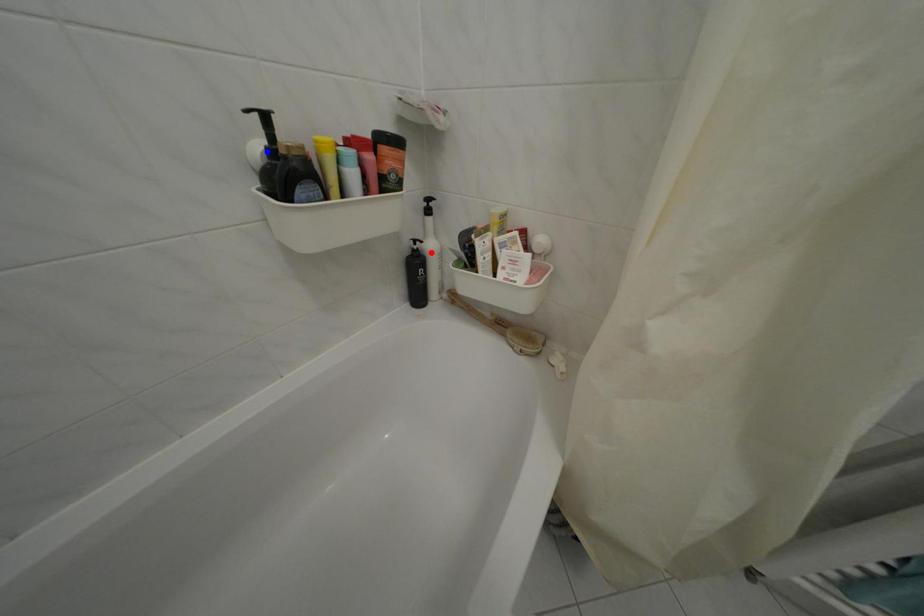
Question: Two points are marked on the image. Which point is closer to the camera?

Choices:
 (A) Blue point is closer.
 (B) Red point is closer.

Answer: (A)